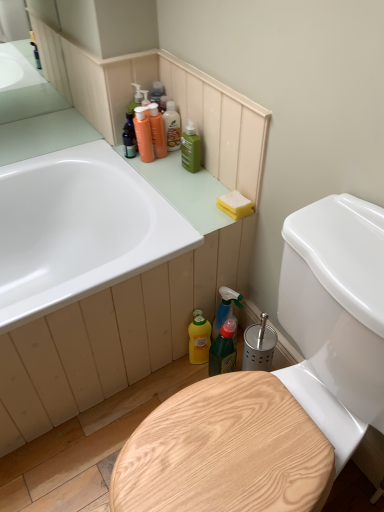
Image resolution: width=384 pixels, height=512 pixels. Find the location of `free space to the left of yellow sponge at upper right`. free space to the left of yellow sponge at upper right is located at coordinates (186, 208).